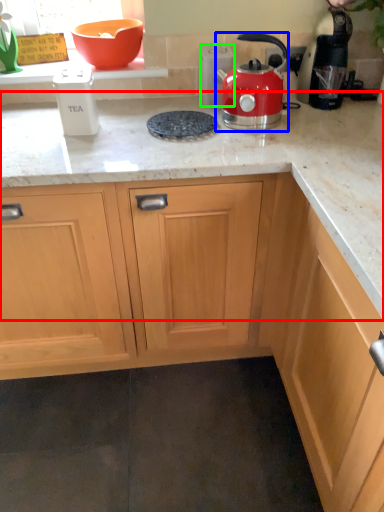
Question: Estimate the real-world distances between objects in this image. Which object is closer to countertop (highlighted by a red box), kitchen appliance (highlighted by a blue box) or kitchen appliance (highlighted by a green box)?

Choices:
 (A) kitchen appliance
 (B) kitchen appliance

Answer: (A)